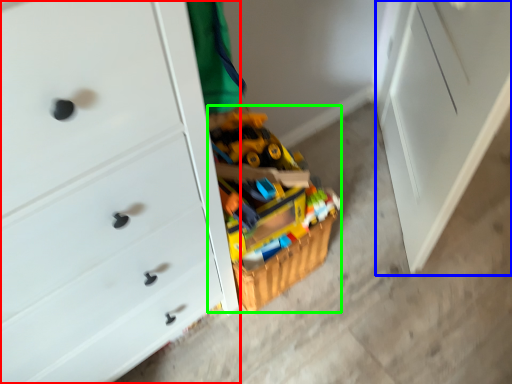
Question: Which is farther away from chest of drawers (highlighted by a red box)? file cabinet (highlighted by a blue box) or toy (highlighted by a green box)?

Choices:
 (A) file cabinet
 (B) toy

Answer: (A)